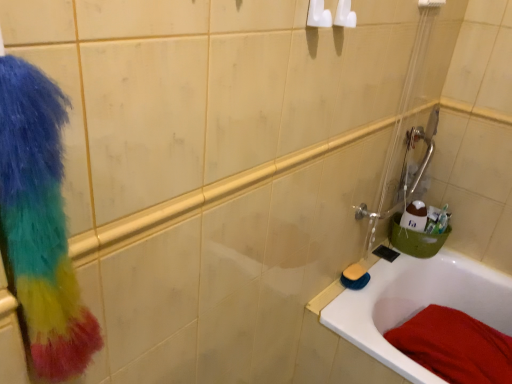
Where is `unoccupied region to the right of yellow sponge at lower right`? Image resolution: width=512 pixels, height=384 pixels. unoccupied region to the right of yellow sponge at lower right is located at coordinates (385, 273).